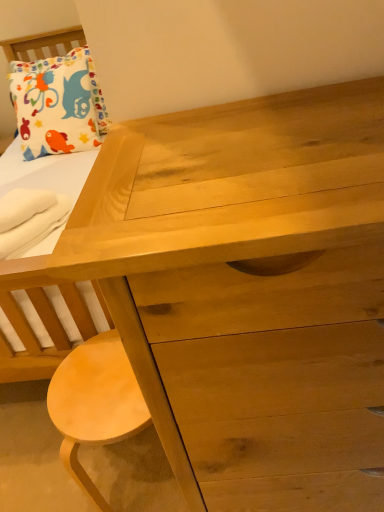
Question: Considering the relative positions of light brown wood stool at lower left and white soft towel at lower left in the image provided, is light brown wood stool at lower left to the left of white soft towel at lower left from the viewer's perspective?

Choices:
 (A) no
 (B) yes

Answer: (A)

Question: From a real-world perspective, is light brown wood stool at lower left under white soft towel at lower left?

Choices:
 (A) no
 (B) yes

Answer: (B)

Question: Is light brown wood stool at lower left further to the viewer compared to white soft towel at lower left?

Choices:
 (A) no
 (B) yes

Answer: (A)

Question: From the image's perspective, does light brown wood stool at lower left appear higher than white soft towel at lower left?

Choices:
 (A) no
 (B) yes

Answer: (A)

Question: Is light brown wood stool at lower left outside white soft towel at lower left?

Choices:
 (A) yes
 (B) no

Answer: (A)

Question: Relative to light brown wood stool at lower left, is white soft towel at lower left in front or behind?

Choices:
 (A) front
 (B) behind

Answer: (B)

Question: Considering the positions of white soft towel at lower left and light brown wood stool at lower left in the image, is white soft towel at lower left taller or shorter than light brown wood stool at lower left?

Choices:
 (A) tall
 (B) short

Answer: (B)

Question: From the image's perspective, is white soft towel at lower left positioned above or below light brown wood stool at lower left?

Choices:
 (A) above
 (B) below

Answer: (A)

Question: In terms of width, does white soft towel at lower left look wider or thinner when compared to light brown wood stool at lower left?

Choices:
 (A) wide
 (B) thin

Answer: (B)

Question: From a real-world perspective, is white soft towel at lower left above or below white cotton pillow at upper left?

Choices:
 (A) above
 (B) below

Answer: (B)

Question: Is white soft towel at lower left taller or shorter than white cotton pillow at upper left?

Choices:
 (A) tall
 (B) short

Answer: (B)

Question: Considering their positions, is white soft towel at lower left located in front of or behind white cotton pillow at upper left?

Choices:
 (A) front
 (B) behind

Answer: (A)

Question: Considering the positions of point (44, 208) and point (43, 146), is point (44, 208) closer or farther from the camera than point (43, 146)?

Choices:
 (A) closer
 (B) farther

Answer: (A)

Question: From their relative heights in the image, would you say white cotton pillow at upper left is taller or shorter than light brown wood stool at lower left?

Choices:
 (A) short
 (B) tall

Answer: (B)

Question: Considering the positions of white cotton pillow at upper left and light brown wood stool at lower left in the image, is white cotton pillow at upper left bigger or smaller than light brown wood stool at lower left?

Choices:
 (A) big
 (B) small

Answer: (A)